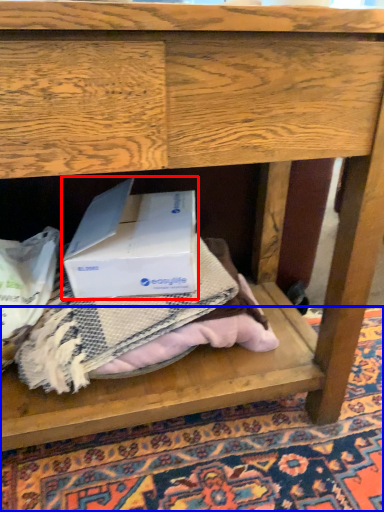
Question: Among these objects, which one is nearest to the camera, box (highlighted by a red box) or mat (highlighted by a blue box)?

Choices:
 (A) box
 (B) mat

Answer: (B)